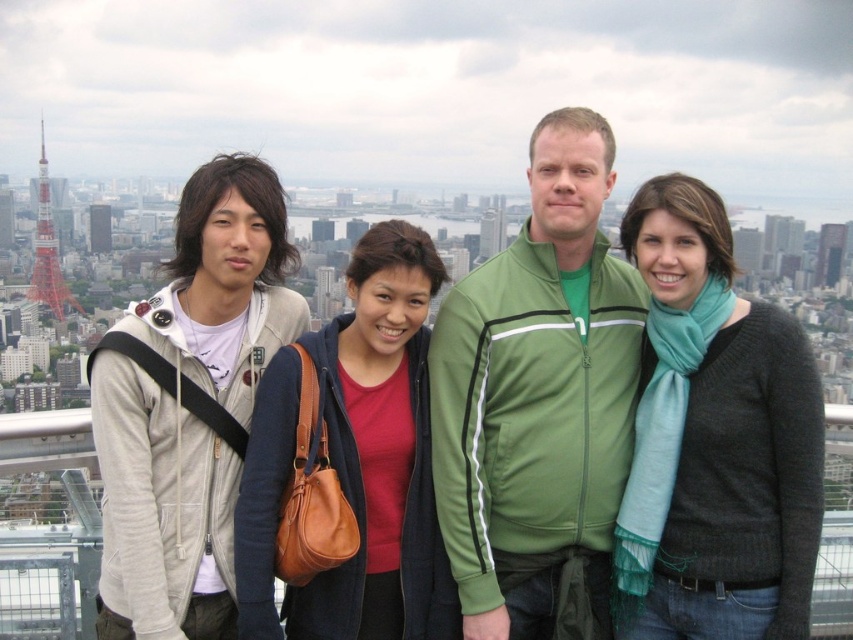
Who is more distant from viewer, (622, 410) or (51, 292)?

Positioned behind is point (51, 292).

Is point (625, 237) positioned in front of point (39, 237)?

Yes, point (625, 237) is closer to viewer.

Find the location of a particular element. The width and height of the screenshot is (853, 640). matte gray hoodie at left is located at coordinates [709, 442].